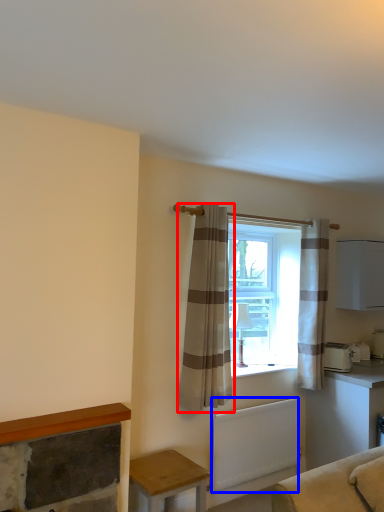
Question: Which of the following is the closest to the observer, curtain (highlighted by a red box) or radiator (highlighted by a blue box)?

Choices:
 (A) curtain
 (B) radiator

Answer: (A)